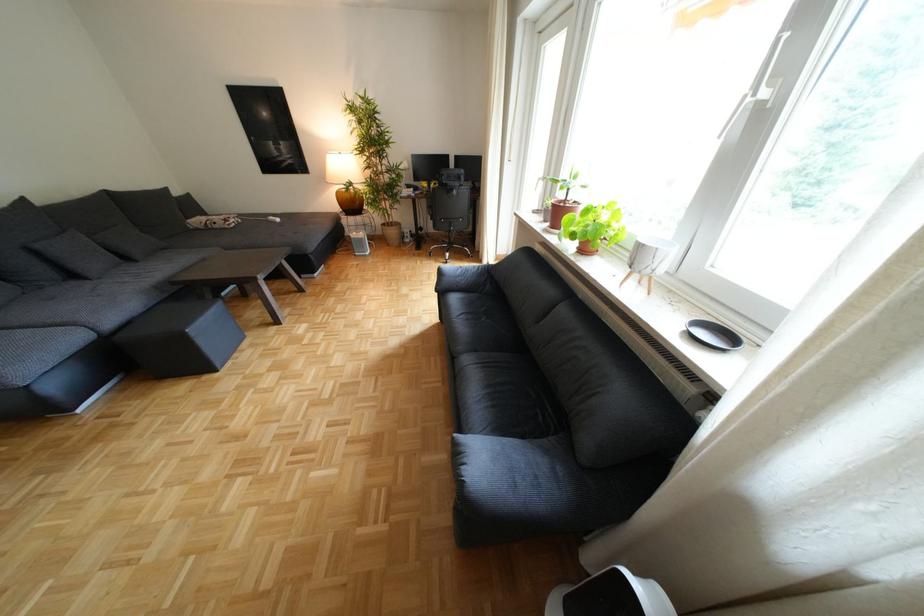
Find where to resting arm the dark grey sofa armrest. Please return your answer as a coordinate pair (x, y).

(482, 463)